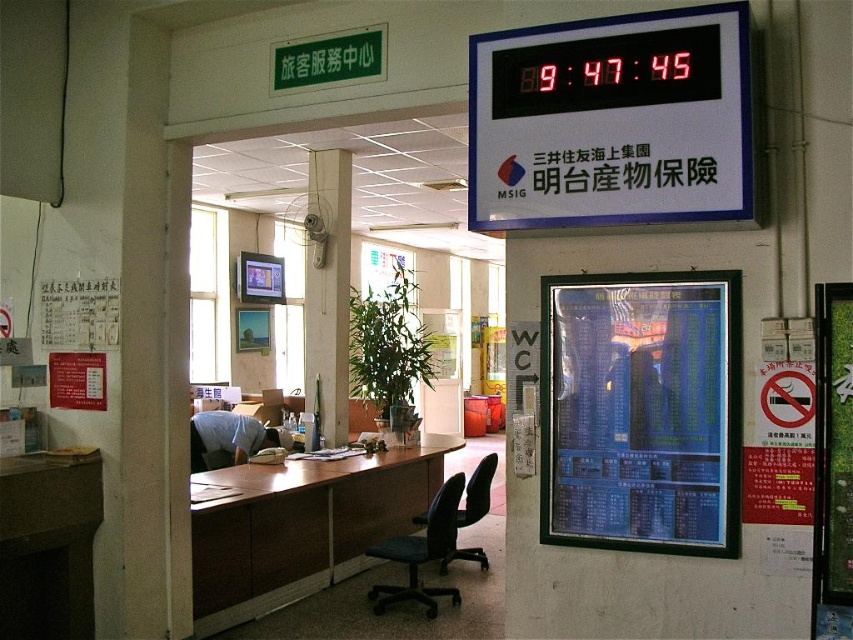
Which is behind, point (718, 461) or point (222, 566)?

Point (222, 566)

Does blue glossy poster at upper center have a lesser height compared to brown wood table at center?

In fact, blue glossy poster at upper center may be taller than brown wood table at center.

This screenshot has width=853, height=640. In order to click on blue glossy poster at upper center in this screenshot , I will do `click(637, 416)`.

Does red digital clock at upper right appear over wooden pillar at center?

Yes, red digital clock at upper right is above wooden pillar at center.

Is red digital clock at upper right positioned before wooden pillar at center?

Yes, red digital clock at upper right is closer to the viewer.

At what (x,y) coordinates should I click in order to perform the action: click on red digital clock at upper right. Please return your answer as a coordinate pair (x, y). Looking at the image, I should click on (611, 122).

Does red digital clock at upper right appear over blue glossy poster at upper center?

Correct, red digital clock at upper right is located above blue glossy poster at upper center.

Which of these two, red digital clock at upper right or blue glossy poster at upper center, stands taller?

Standing taller between the two is blue glossy poster at upper center.

Does point (593, 118) come behind point (697, 515)?

No, (593, 118) is in front of (697, 515).

I want to click on red digital clock at upper right, so click(x=611, y=122).